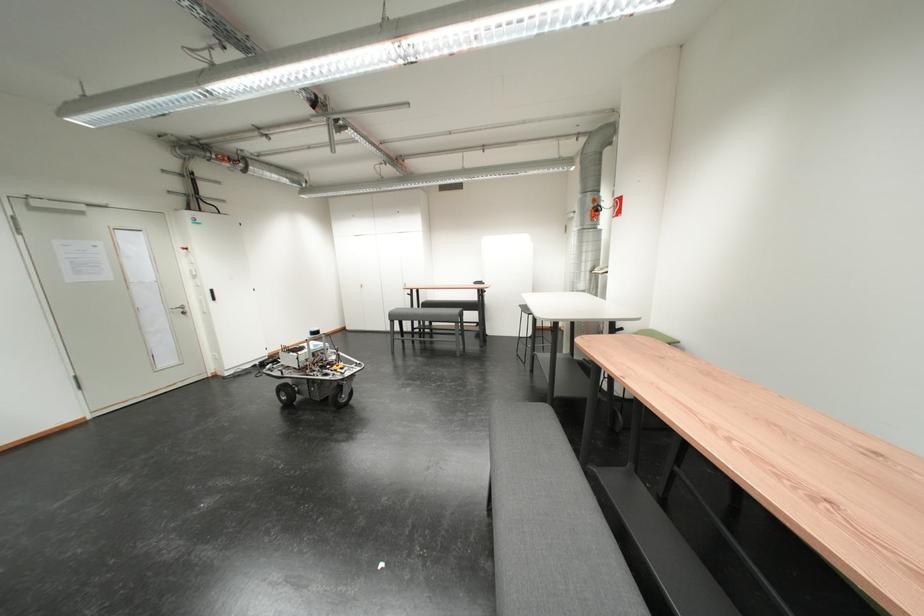
I want to click on silver door handle, so click(179, 309).